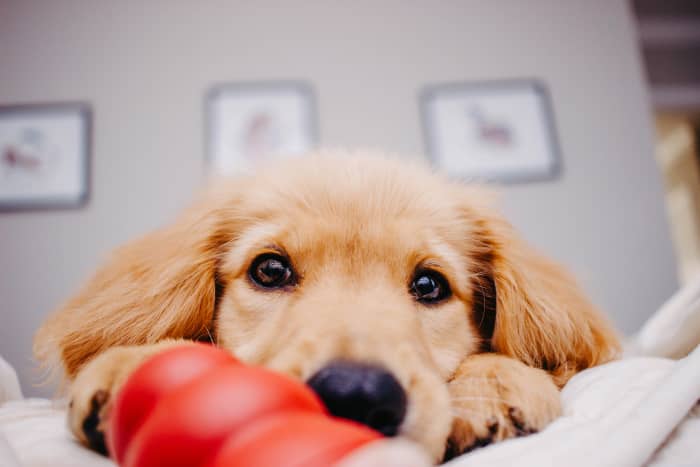
Where is `picture frames`? This screenshot has width=700, height=467. picture frames is located at coordinates 33,159, 266,134, 444,122.